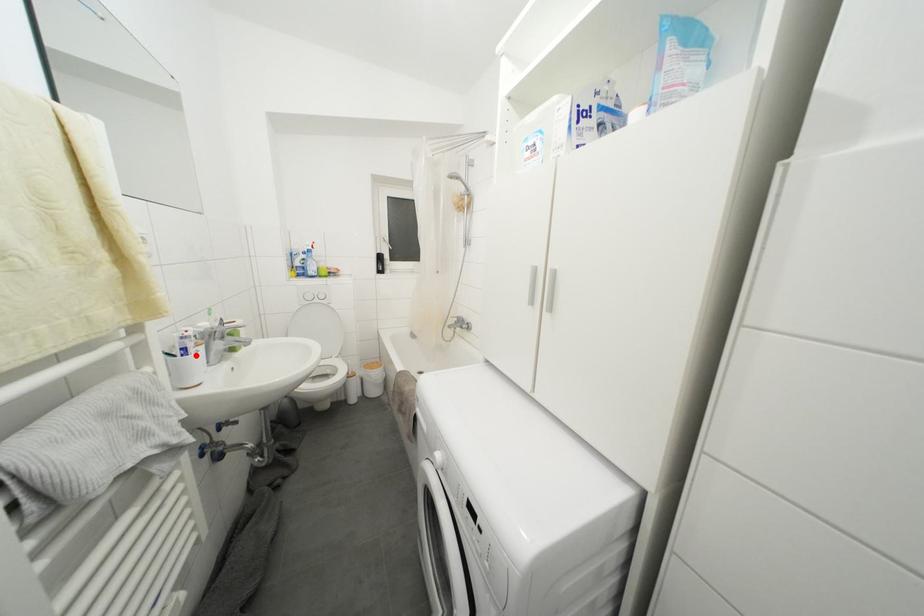
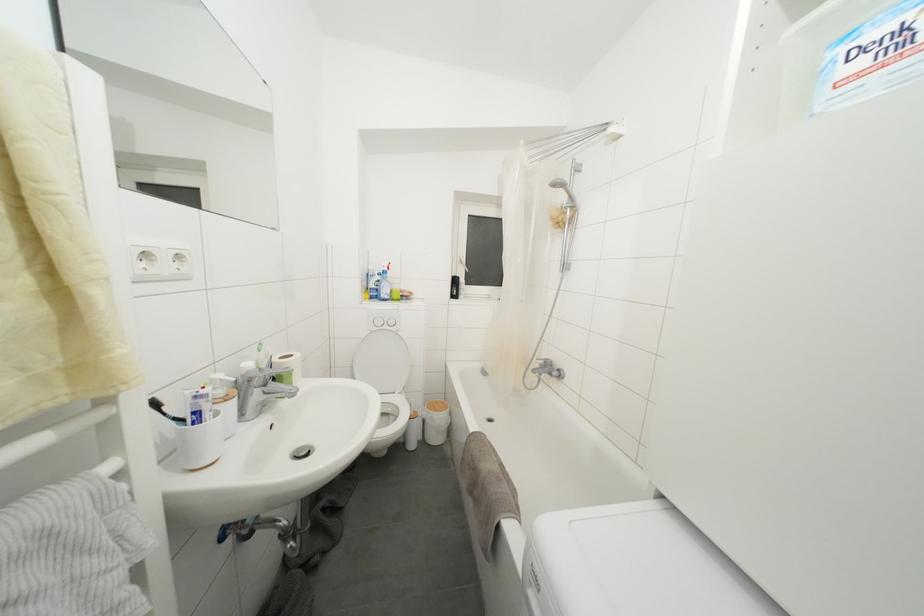
The point at the highlighted location is marked in the first image. Where is the corresponding point in the second image?

(211, 419)